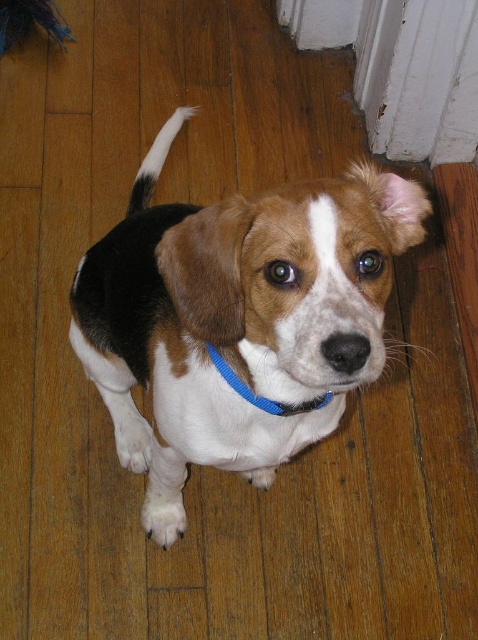
Does brown/white fur dog at center have a smaller size compared to blue fabric neckband at center?

Incorrect, brown/white fur dog at center is not smaller in size than blue fabric neckband at center.

Consider the image. Which is above, brown/white fur dog at center or blue fabric neckband at center?

Positioned higher is brown/white fur dog at center.

Who is more distant from viewer, (288, 376) or (213, 358)?

The point (213, 358) is more distant.

Find the location of `brown/white fur dog at center`. brown/white fur dog at center is located at coordinates (238, 320).

Who is lower down, white fur tail at upper center or blue fabric neckband at center?

blue fabric neckband at center

Who is shorter, white fur tail at upper center or blue fabric neckband at center?

Standing shorter between the two is blue fabric neckband at center.

Who is more distant from viewer, (148, 188) or (229, 380)?

Point (148, 188)

Locate an element on the screen. Image resolution: width=478 pixels, height=640 pixels. white fur tail at upper center is located at coordinates (155, 160).

Is brown/white fur dog at center thinner than white fur tail at upper center?

No.

Is point (226, 298) closer to camera compared to point (137, 179)?

Yes, it is.

Which is in front, point (94, 273) or point (136, 200)?

Point (94, 273) is more forward.

Locate an element on the screen. This screenshot has height=640, width=478. brown/white fur dog at center is located at coordinates (238, 320).